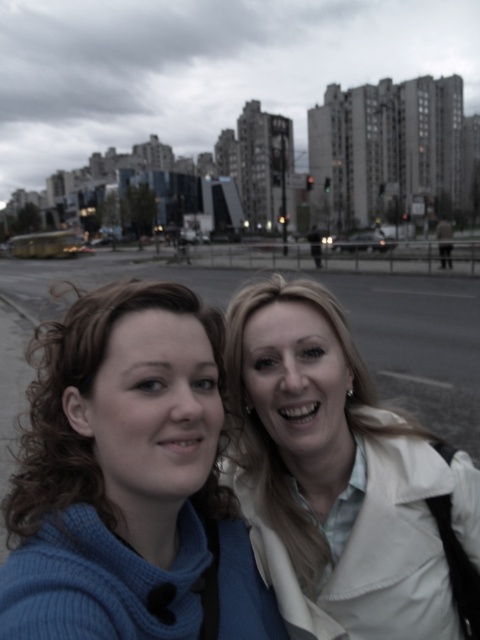
Is blue knitted sweater at center bigger than white matte jacket at center?

Correct, blue knitted sweater at center is larger in size than white matte jacket at center.

What are the coordinates of `blue knitted sweater at center` in the screenshot? It's located at (129, 481).